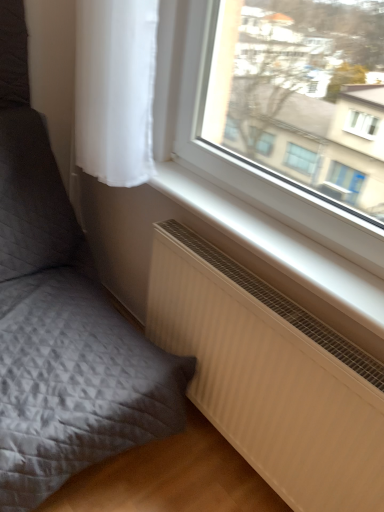
Question: From a real-world perspective, is white ribbed radiator at lower right over matte gray cushion at lower left?

Choices:
 (A) no
 (B) yes

Answer: (A)

Question: Considering the relative sizes of white ribbed radiator at lower right and matte gray cushion at lower left in the image provided, is white ribbed radiator at lower right shorter than matte gray cushion at lower left?

Choices:
 (A) no
 (B) yes

Answer: (B)

Question: Considering the relative sizes of white ribbed radiator at lower right and matte gray cushion at lower left in the image provided, is white ribbed radiator at lower right bigger than matte gray cushion at lower left?

Choices:
 (A) no
 (B) yes

Answer: (A)

Question: Is white ribbed radiator at lower right next to matte gray cushion at lower left?

Choices:
 (A) no
 (B) yes

Answer: (A)

Question: Is white ribbed radiator at lower right facing away from matte gray cushion at lower left?

Choices:
 (A) no
 (B) yes

Answer: (A)

Question: From the image's perspective, is white ribbed radiator at lower right beneath matte gray cushion at lower left?

Choices:
 (A) yes
 (B) no

Answer: (A)

Question: Is white matte window sill at lower center facing away from matte gray cushion at lower left?

Choices:
 (A) no
 (B) yes

Answer: (A)

Question: Is white matte window sill at lower center aimed at matte gray cushion at lower left?

Choices:
 (A) yes
 (B) no

Answer: (A)

Question: Can you confirm if white matte window sill at lower center is wider than matte gray cushion at lower left?

Choices:
 (A) no
 (B) yes

Answer: (A)

Question: From a real-world perspective, is white matte window sill at lower center physically above matte gray cushion at lower left?

Choices:
 (A) no
 (B) yes

Answer: (B)

Question: Considering the relative positions of white matte window sill at lower center and matte gray cushion at lower left in the image provided, is white matte window sill at lower center to the left of matte gray cushion at lower left from the viewer's perspective?

Choices:
 (A) no
 (B) yes

Answer: (A)

Question: From the image's perspective, is white matte window sill at lower center under matte gray cushion at lower left?

Choices:
 (A) no
 (B) yes

Answer: (A)

Question: Considering the relative sizes of white sheer curtain at upper left and matte gray cushion at lower left in the image provided, is white sheer curtain at upper left taller than matte gray cushion at lower left?

Choices:
 (A) no
 (B) yes

Answer: (A)